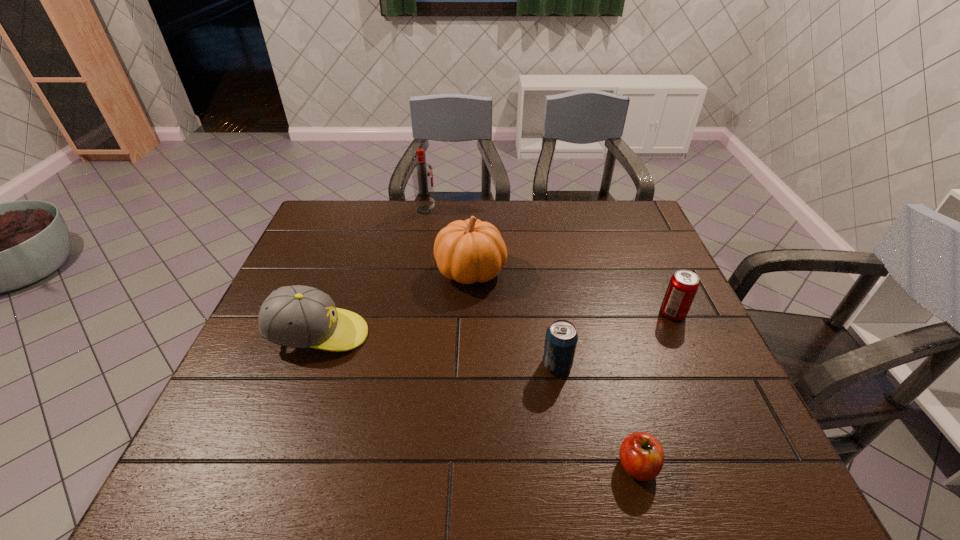
Locate an element on the screen. Image resolution: width=960 pixels, height=540 pixels. the nearest object is located at coordinates (641, 455).

Locate an element on the screen. free space located 0.180m on the front label of the vodka is located at coordinates (487, 210).

This screenshot has width=960, height=540. In order to click on free space located 0.150m on the right of the fifth nearest object in this screenshot , I will do `click(557, 272)`.

Identify the location of blank space located on the front-facing side of the baseball cap. (420, 335).

In order to click on vacant space located 0.220m on the back of the farther pop soda in this screenshot , I will do `click(645, 254)`.

Identify the location of vacant space located on the front of the nearer pop soda. The image size is (960, 540). (577, 488).

Locate an element on the screen. This screenshot has height=540, width=960. vacant space located 0.260m on the back of the fifth object from left to right is located at coordinates (604, 345).

I want to click on object that is positioned at the far edge, so coord(422,173).

The height and width of the screenshot is (540, 960). Find the location of `object at the near edge`. object at the near edge is located at coordinates (641, 455).

In order to click on object at the left edge in this screenshot , I will do `click(297, 316)`.